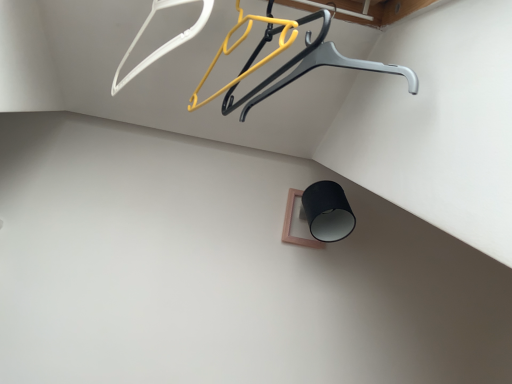
Question: From the image's perspective, does yellow plastic hanger at upper center, the 1th hanger when ordered from right to left, appear higher than white plastic hanger at upper left, which appears as the first hanger when viewed from the left?

Choices:
 (A) yes
 (B) no

Answer: (B)

Question: Considering the relative sizes of yellow plastic hanger at upper center, the 1th hanger when ordered from right to left, and white plastic hanger at upper left, which appears as the first hanger when viewed from the left, in the image provided, is yellow plastic hanger at upper center, the 1th hanger when ordered from right to left, thinner than white plastic hanger at upper left, which appears as the first hanger when viewed from the left,?

Choices:
 (A) no
 (B) yes

Answer: (A)

Question: Considering the relative sizes of yellow plastic hanger at upper center, arranged as the second hanger when viewed from the left, and white plastic hanger at upper left, the second hanger from the right, in the image provided, is yellow plastic hanger at upper center, arranged as the second hanger when viewed from the left, shorter than white plastic hanger at upper left, the second hanger from the right,?

Choices:
 (A) no
 (B) yes

Answer: (B)

Question: Is white plastic hanger at upper left, the second hanger from the right, a part of yellow plastic hanger at upper center, arranged as the second hanger when viewed from the left?

Choices:
 (A) no
 (B) yes

Answer: (A)

Question: Is yellow plastic hanger at upper center, the 1th hanger when ordered from right to left, oriented towards white plastic hanger at upper left, which appears as the first hanger when viewed from the left?

Choices:
 (A) no
 (B) yes

Answer: (A)

Question: Would you say yellow plastic hanger at upper center, the 1th hanger when ordered from right to left, is outside white plastic hanger at upper left, which appears as the first hanger when viewed from the left?

Choices:
 (A) no
 (B) yes

Answer: (B)

Question: Is metallic gray hanger at upper center taller than yellow plastic hanger at upper center, arranged as the second hanger when viewed from the left?

Choices:
 (A) yes
 (B) no

Answer: (B)

Question: From a real-world perspective, is metallic gray hanger at upper center located beneath yellow plastic hanger at upper center, arranged as the second hanger when viewed from the left?

Choices:
 (A) yes
 (B) no

Answer: (A)

Question: Is metallic gray hanger at upper center not inside yellow plastic hanger at upper center, arranged as the second hanger when viewed from the left?

Choices:
 (A) no
 (B) yes

Answer: (B)

Question: Does metallic gray hanger at upper center have a lesser height compared to yellow plastic hanger at upper center, the 1th hanger when ordered from right to left?

Choices:
 (A) no
 (B) yes

Answer: (B)

Question: Can you confirm if metallic gray hanger at upper center is thinner than yellow plastic hanger at upper center, arranged as the second hanger when viewed from the left?

Choices:
 (A) no
 (B) yes

Answer: (A)

Question: Considering the relative positions of metallic gray hanger at upper center and yellow plastic hanger at upper center, arranged as the second hanger when viewed from the left, in the image provided, is metallic gray hanger at upper center to the left of yellow plastic hanger at upper center, arranged as the second hanger when viewed from the left, from the viewer's perspective?

Choices:
 (A) yes
 (B) no

Answer: (B)

Question: Does white plastic hanger at upper left, the second hanger from the right, have a larger size compared to metallic gray hanger at upper center?

Choices:
 (A) no
 (B) yes

Answer: (A)